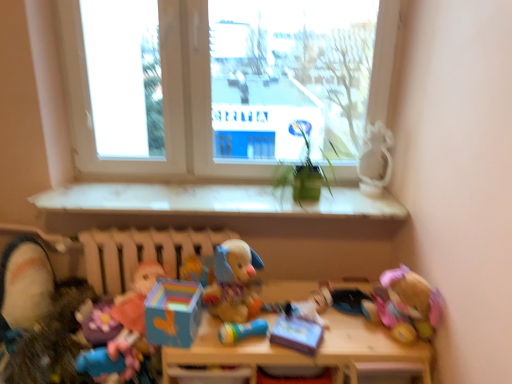
Question: From a real-world perspective, is white matte radiator at center physically above soft plush toy at lower left, the tenth toy positioned from the right?

Choices:
 (A) yes
 (B) no

Answer: (A)

Question: Does white matte radiator at center appear on the left side of soft plush toy at lower left, the tenth toy positioned from the right?

Choices:
 (A) yes
 (B) no

Answer: (B)

Question: Is white matte radiator at center smaller than soft plush toy at lower left, which is the first toy from left to right?

Choices:
 (A) yes
 (B) no

Answer: (B)

Question: Could you tell me if white matte radiator at center is facing soft plush toy at lower left, which is the first toy from left to right?

Choices:
 (A) no
 (B) yes

Answer: (B)

Question: Can you confirm if white matte radiator at center is wider than soft plush toy at lower left, which is the first toy from left to right?

Choices:
 (A) yes
 (B) no

Answer: (B)

Question: From the image's perspective, is transparent glass window at center, acting as the first window screen starting from the right, positioned above or below green matte plant at center?

Choices:
 (A) below
 (B) above

Answer: (B)

Question: Which is correct: transparent glass window at center, acting as the first window screen starting from the right, is inside green matte plant at center, or outside of it?

Choices:
 (A) outside
 (B) inside

Answer: (A)

Question: Is point (334, 77) positioned closer to the camera than point (313, 165)?

Choices:
 (A) closer
 (B) farther

Answer: (B)

Question: From a real-world perspective, is transparent glass window at center, acting as the first window screen starting from the right, above or below green matte plant at center?

Choices:
 (A) below
 (B) above

Answer: (B)

Question: From a real-world perspective, is soft plush toy at lower left, which is the first toy from left to right, above or below white glossy window sill at center?

Choices:
 (A) above
 (B) below

Answer: (B)

Question: Is soft plush toy at lower left, the tenth toy positioned from the right, taller or shorter than white glossy window sill at center?

Choices:
 (A) short
 (B) tall

Answer: (B)

Question: Does point (17, 369) appear closer or farther from the camera than point (381, 200)?

Choices:
 (A) closer
 (B) farther

Answer: (A)

Question: Is soft plush toy at lower left, which is the first toy from left to right, wider or thinner than white glossy window sill at center?

Choices:
 (A) thin
 (B) wide

Answer: (B)

Question: From the image's perspective, relative to matte cardboard box at center, the eighth toy viewed from the left, is wooden table at center above or below?

Choices:
 (A) above
 (B) below

Answer: (B)

Question: Looking at the image, does wooden table at center seem bigger or smaller compared to matte cardboard box at center, which ranks as the 3th toy in right-to-left order?

Choices:
 (A) big
 (B) small

Answer: (A)